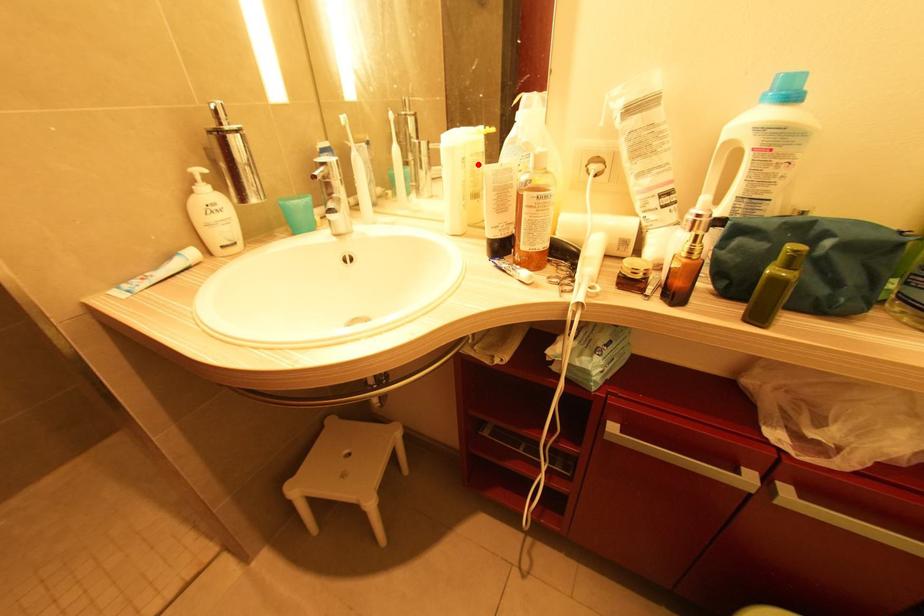
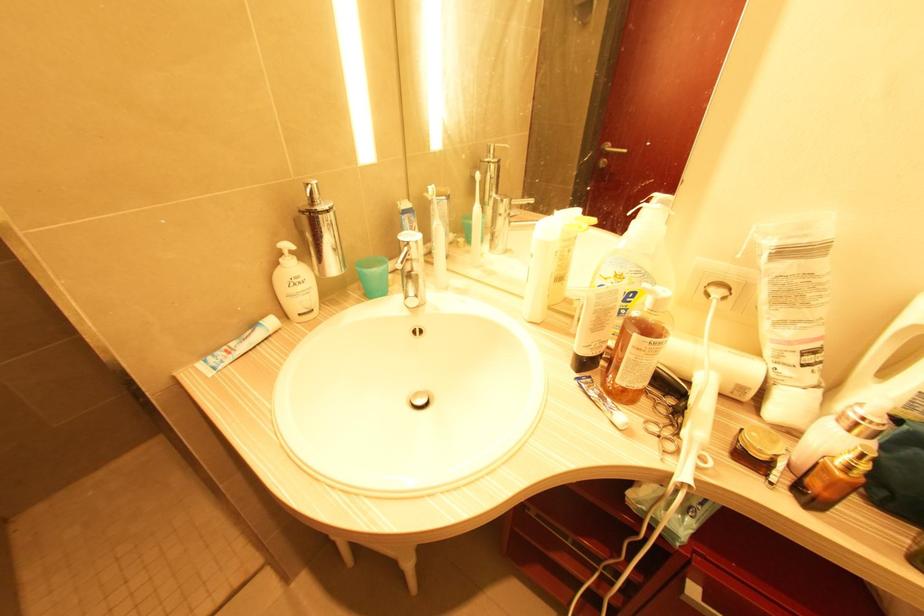
Locate, in the second image, the point that corresponds to the highlighted location in the first image.

(569, 249)